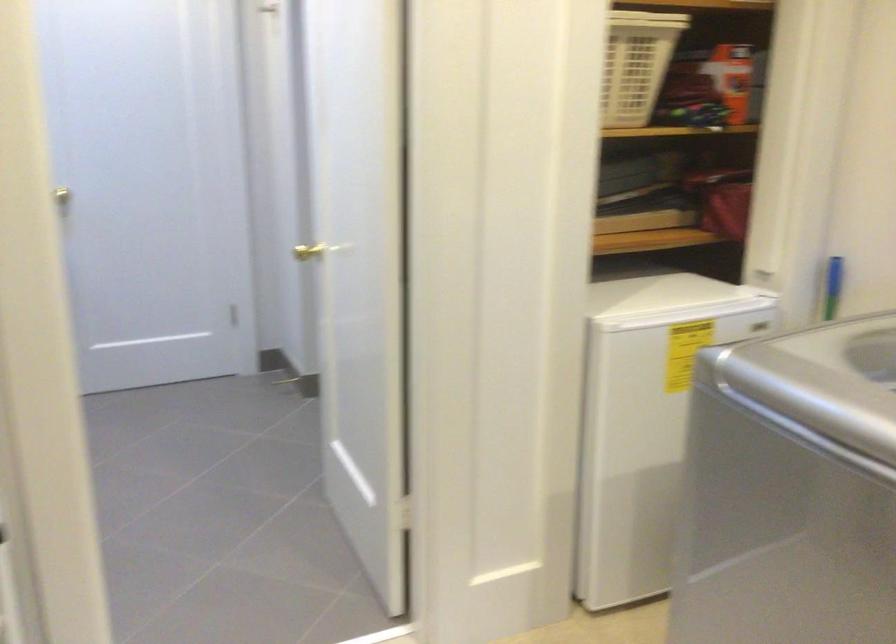
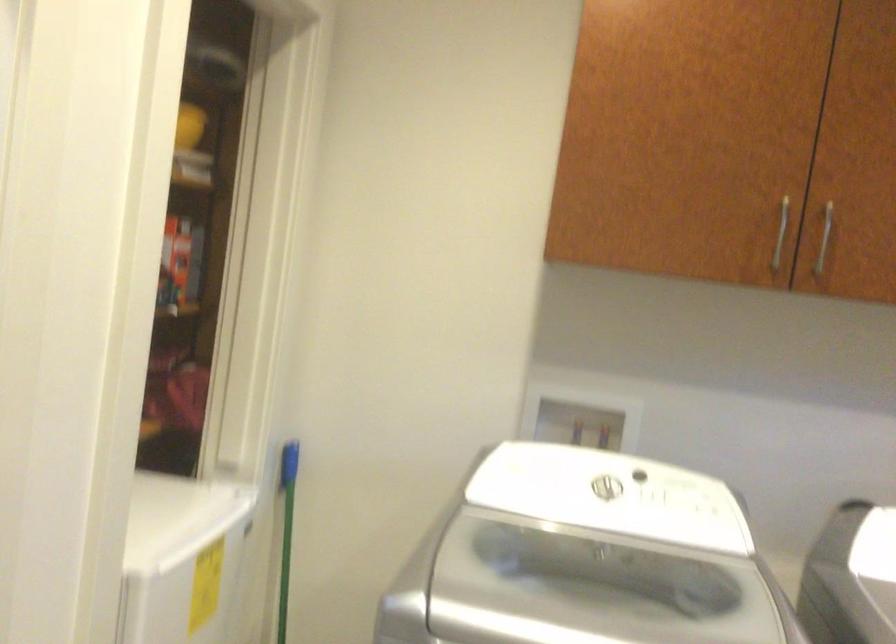
Question: I am providing you with two images of the same scene from different viewpoints. Which of the following objects are not visible in image2?

Choices:
 (A) white laundry basket
 (B) silver cabinet handle
 (C) washing machine lid
 (D) red glass vase

Answer: (A)